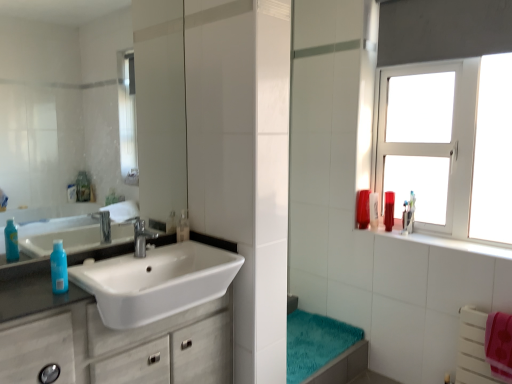
Question: Is clear glass mirror at upper left at the left side of teal plush bath towel at lower center?

Choices:
 (A) yes
 (B) no

Answer: (A)

Question: Considering the relative sizes of clear glass mirror at upper left and teal plush bath towel at lower center in the image provided, is clear glass mirror at upper left taller than teal plush bath towel at lower center?

Choices:
 (A) yes
 (B) no

Answer: (A)

Question: From the image's perspective, does clear glass mirror at upper left appear lower than teal plush bath towel at lower center?

Choices:
 (A) no
 (B) yes

Answer: (A)

Question: Is clear glass mirror at upper left further to the viewer compared to teal plush bath towel at lower center?

Choices:
 (A) yes
 (B) no

Answer: (B)

Question: Could you tell me if clear glass mirror at upper left is turned towards teal plush bath towel at lower center?

Choices:
 (A) no
 (B) yes

Answer: (A)

Question: From the image's perspective, is translucent plastic mouthwash at upper right, which is counted as the 3th mouthwash, starting from the back, above or below clear glass mirror at upper left?

Choices:
 (A) above
 (B) below

Answer: (B)

Question: Considering the positions of translucent plastic mouthwash at upper right, the 1th mouthwash positioned from the right, and clear glass mirror at upper left in the image, is translucent plastic mouthwash at upper right, the 1th mouthwash positioned from the right, bigger or smaller than clear glass mirror at upper left?

Choices:
 (A) small
 (B) big

Answer: (A)

Question: In the image, is translucent plastic mouthwash at upper right, placed as the second mouthwash when sorted from front to back, positioned in front of or behind clear glass mirror at upper left?

Choices:
 (A) behind
 (B) front

Answer: (A)

Question: Is translucent plastic mouthwash at upper right, which is counted as the 3th mouthwash, starting from the back, taller or shorter than clear glass mirror at upper left?

Choices:
 (A) tall
 (B) short

Answer: (B)

Question: Considering their positions, is translucent plastic bottle at left located in front of or behind translucent plastic mouthwash at right, the 3th mouthwash when ordered from front to back?

Choices:
 (A) behind
 (B) front

Answer: (B)

Question: From a real-world perspective, relative to translucent plastic mouthwash at right, acting as the 2th mouthwash starting from the back, is translucent plastic bottle at left vertically above or below?

Choices:
 (A) above
 (B) below

Answer: (A)

Question: Is point (61, 281) positioned closer to the camera than point (376, 198)?

Choices:
 (A) farther
 (B) closer

Answer: (B)

Question: Is translucent plastic bottle at left taller or shorter than translucent plastic mouthwash at right, the 2th mouthwash viewed from the right?

Choices:
 (A) short
 (B) tall

Answer: (A)

Question: Considering the positions of silver metallic faucet at center and teal plush bath towel at lower center in the image, is silver metallic faucet at center taller or shorter than teal plush bath towel at lower center?

Choices:
 (A) short
 (B) tall

Answer: (B)

Question: Choose the correct answer: Is silver metallic faucet at center inside teal plush bath towel at lower center or outside it?

Choices:
 (A) inside
 (B) outside

Answer: (B)